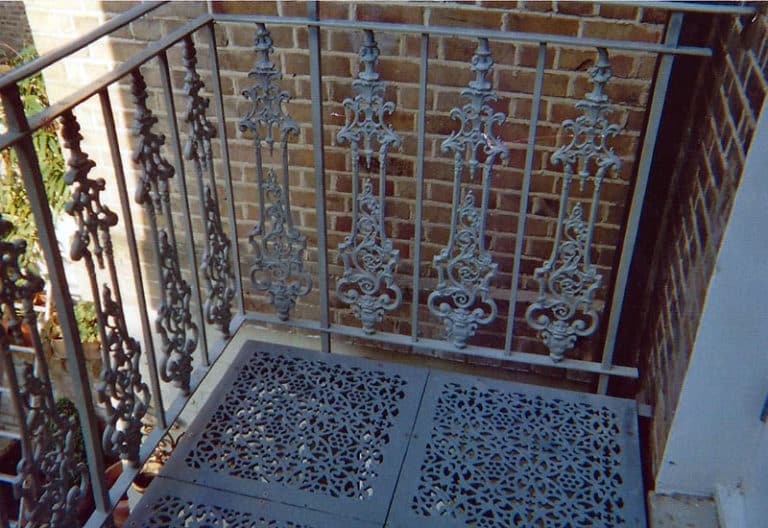
Find the location of `brick wall`. brick wall is located at coordinates (709, 211), (51, 27), (332, 185), (300, 183), (442, 194), (404, 193), (504, 208), (541, 210), (613, 221), (243, 187).